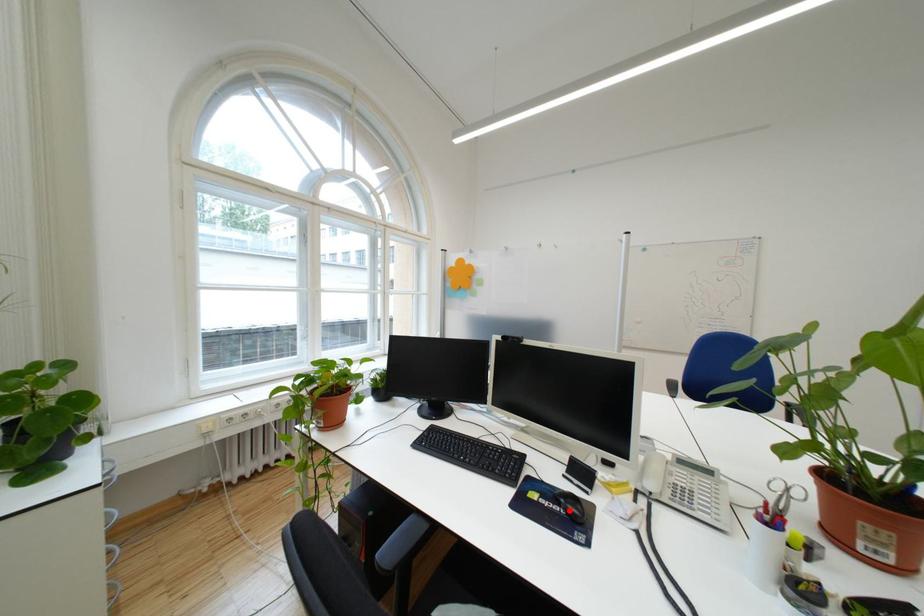
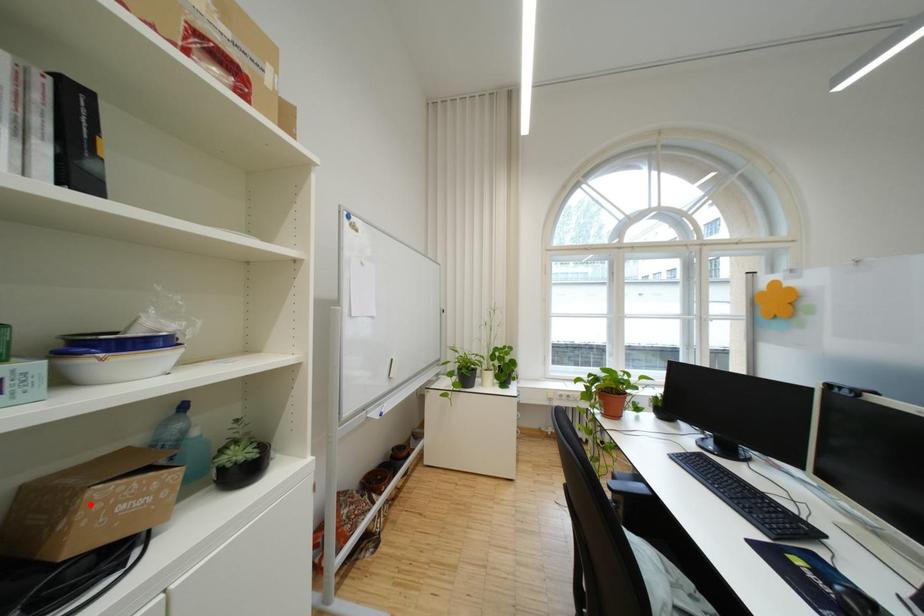
I am providing you with two images of the same scene from different viewpoints. A red point is marked on the first image and another point is marked on the second image. Is the marked point in image1 the same physical position as the marked point in image2?

No